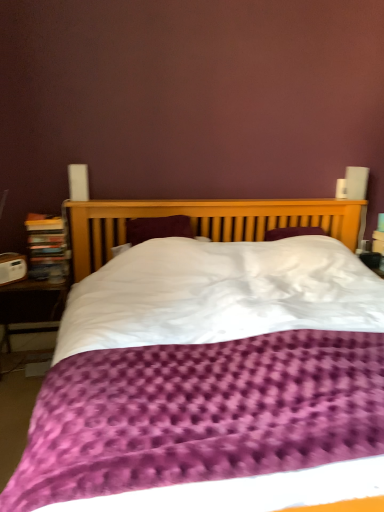
Find the location of a particular element. free spot in front of wooden bookcase at left is located at coordinates (38, 279).